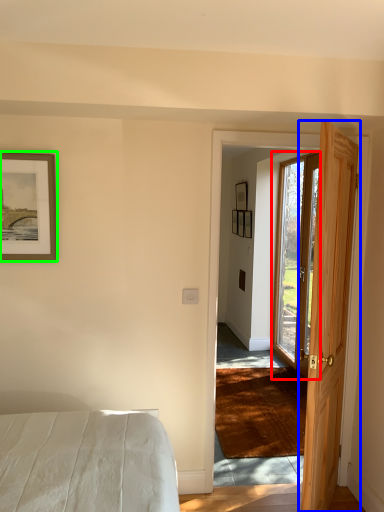
Question: Considering the real-world distances, which object is closest to door (highlighted by a red box)? door (highlighted by a blue box) or picture frame (highlighted by a green box).

Choices:
 (A) door
 (B) picture frame

Answer: (A)